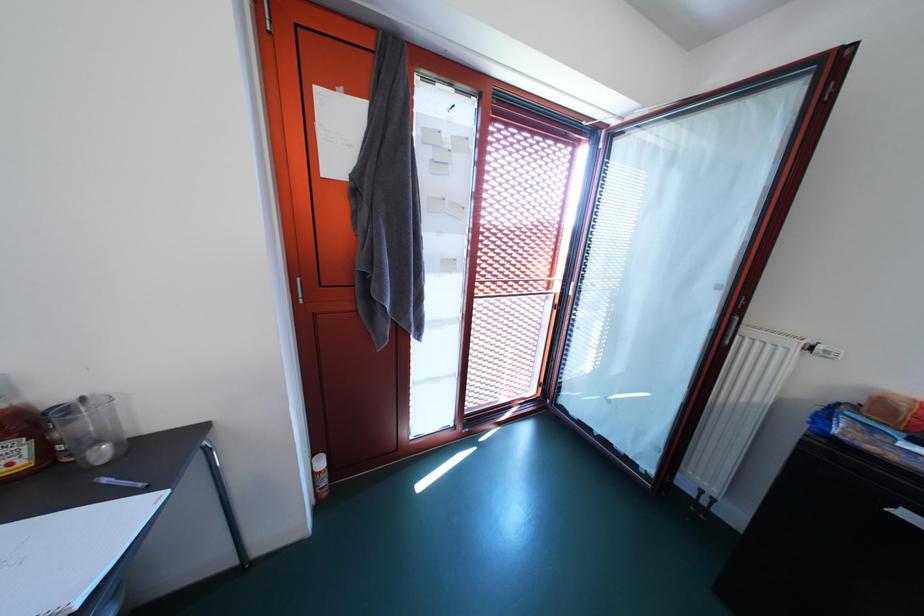
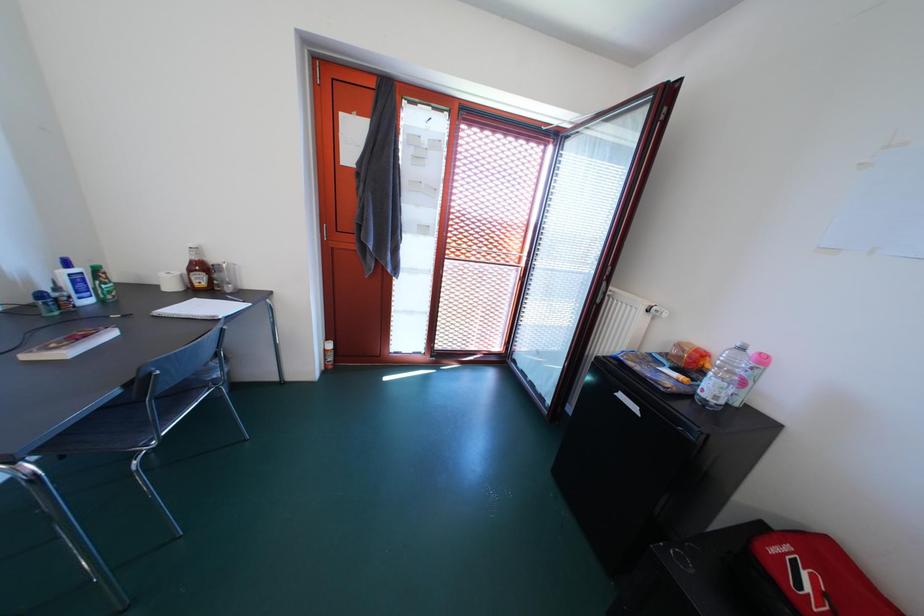
What movement of the cameraman would produce the second image?

The cameraman walked toward right, backward.